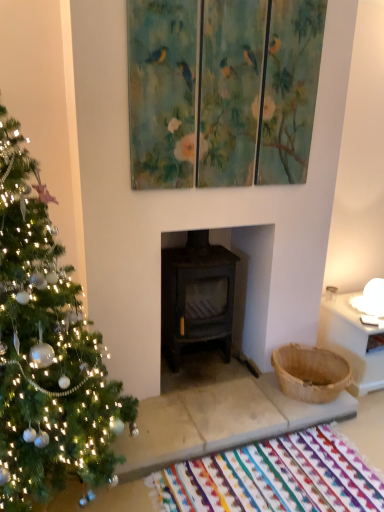
Question: Does green matte christmas tree at left appear on the right side of multicolored woven mat at lower center?

Choices:
 (A) no
 (B) yes

Answer: (A)

Question: Considering the relative positions of green matte christmas tree at left and multicolored woven mat at lower center in the image provided, is green matte christmas tree at left to the left of multicolored woven mat at lower center from the viewer's perspective?

Choices:
 (A) no
 (B) yes

Answer: (B)

Question: Does green matte christmas tree at left have a greater height compared to multicolored woven mat at lower center?

Choices:
 (A) yes
 (B) no

Answer: (A)

Question: Considering the relative sizes of green matte christmas tree at left and multicolored woven mat at lower center in the image provided, is green matte christmas tree at left shorter than multicolored woven mat at lower center?

Choices:
 (A) yes
 (B) no

Answer: (B)

Question: Considering the relative positions of green matte christmas tree at left and multicolored woven mat at lower center in the image provided, is green matte christmas tree at left behind multicolored woven mat at lower center?

Choices:
 (A) no
 (B) yes

Answer: (A)

Question: Is green matte christmas tree at left facing away from multicolored woven mat at lower center?

Choices:
 (A) no
 (B) yes

Answer: (A)

Question: Is multicolored woven mat at lower center at the left side of painted wood triptych at upper center?

Choices:
 (A) no
 (B) yes

Answer: (A)

Question: Does multicolored woven mat at lower center appear on the right side of painted wood triptych at upper center?

Choices:
 (A) no
 (B) yes

Answer: (B)

Question: From a real-world perspective, is multicolored woven mat at lower center physically above painted wood triptych at upper center?

Choices:
 (A) yes
 (B) no

Answer: (B)

Question: From a real-world perspective, is multicolored woven mat at lower center under painted wood triptych at upper center?

Choices:
 (A) no
 (B) yes

Answer: (B)

Question: Is multicolored woven mat at lower center wider than painted wood triptych at upper center?

Choices:
 (A) no
 (B) yes

Answer: (B)

Question: Could you tell me if multicolored woven mat at lower center is turned towards painted wood triptych at upper center?

Choices:
 (A) yes
 (B) no

Answer: (B)

Question: From a real-world perspective, is multicolored woven mat at lower center below green matte christmas tree at left?

Choices:
 (A) no
 (B) yes

Answer: (B)